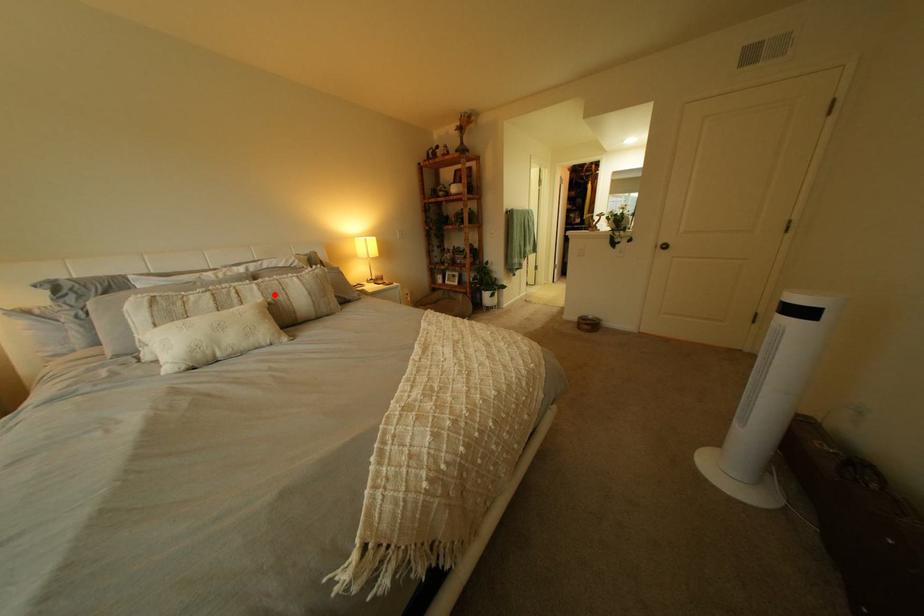
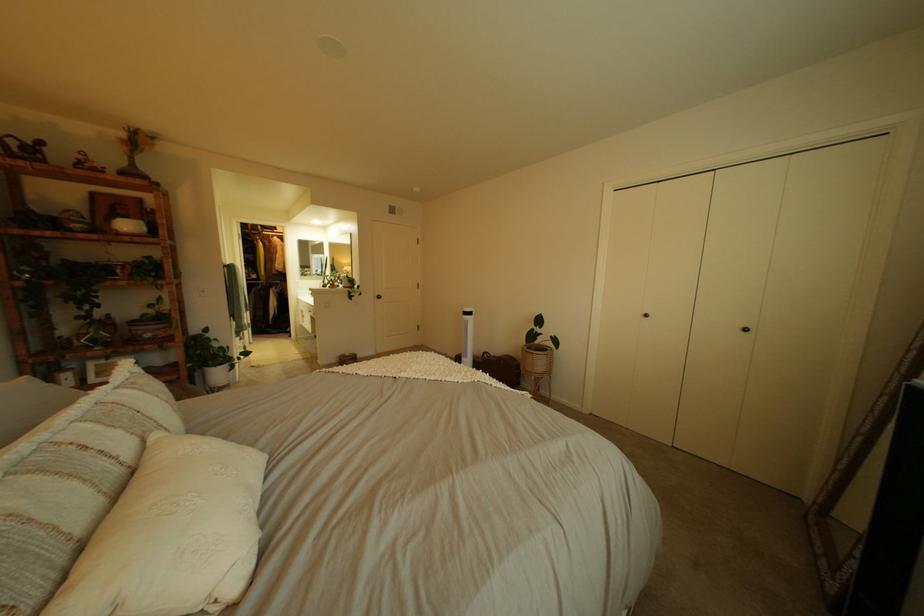
Question: A red point is marked in image1. In image2, is the corresponding 3D point closer to the camera or farther? Reply with the corresponding letter.

Choices:
 (A) The corresponding 3D point is closer.
 (B) The corresponding 3D point is farther.

Answer: (B)